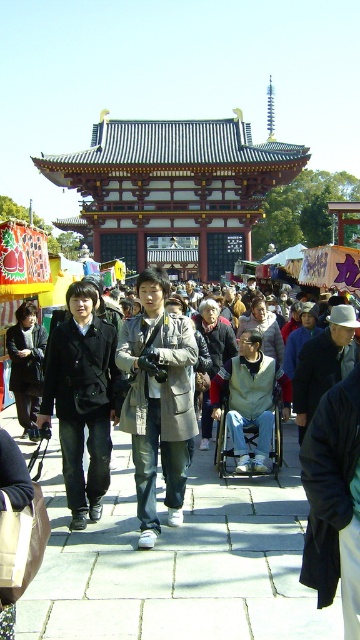
Between beige fabric coat at center and black fabric coat at center, which one has more height?

Standing taller between the two is beige fabric coat at center.

Does beige fabric coat at center come behind black fabric coat at center?

That is False.

Is point (140, 275) positioned behind point (47, 387)?

That is True.

Where is `beige fabric coat at center`? The width and height of the screenshot is (360, 640). beige fabric coat at center is located at coordinates (158, 401).

Can you confirm if shiny dark brown wooden gate at center is smaller than black fabric coat at center?

Incorrect, shiny dark brown wooden gate at center is not smaller in size than black fabric coat at center.

Between shiny dark brown wooden gate at center and black fabric coat at center, which one is positioned lower?

black fabric coat at center is lower down.

At what (x,y) coordinates should I click in order to perform the action: click on shiny dark brown wooden gate at center. Please return your answer as a coordinate pair (x, y). Looking at the image, I should click on (174, 188).

At what (x,y) coordinates should I click in order to perform the action: click on shiny dark brown wooden gate at center. Please return your answer as a coordinate pair (x, y). Looking at the image, I should click on (174, 188).

Consider the image. Which is below, white felt hat at center or gray plastic wheelchair at center?

gray plastic wheelchair at center is lower down.

You are a GUI agent. You are given a task and a screenshot of the screen. Output one action in this format:
    pyautogui.click(x=<x>, y=<y>)
    Task: Click on the white felt hat at center
    This screenshot has height=640, width=360.
    Given the screenshot: What is the action you would take?
    pyautogui.click(x=322, y=364)

Which is behind, point (331, 380) or point (272, 464)?

The point (331, 380) is more distant.

Locate an element on the screen. white felt hat at center is located at coordinates (322, 364).